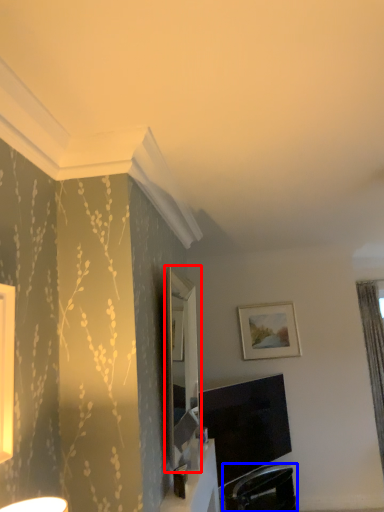
Question: Among these objects, which one is farthest to the camera, mirror (highlighted by a red box) or swivel chair (highlighted by a blue box)?

Choices:
 (A) mirror
 (B) swivel chair

Answer: (B)